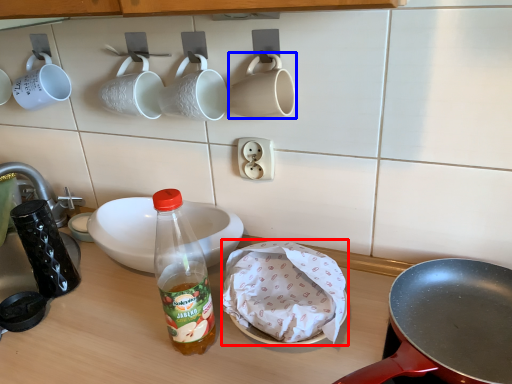
Question: Which object is closer to the camera taking this photo, food (highlighted by a red box) or coffee cup (highlighted by a blue box)?

Choices:
 (A) food
 (B) coffee cup

Answer: (A)